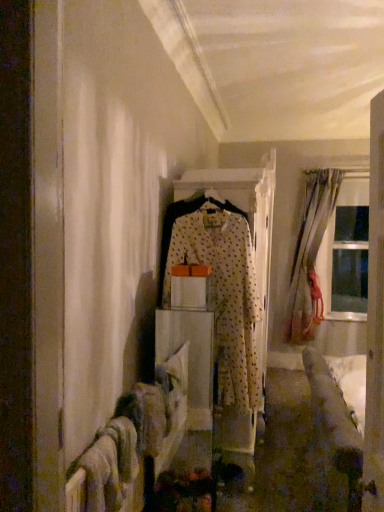
Question: Should I look upward or downward to see transparent glass window at right?

Choices:
 (A) down
 (B) up

Answer: (B)

Question: Is wooden door at right positioned before transparent glass window at right?

Choices:
 (A) no
 (B) yes

Answer: (B)

Question: Is wooden door at right not within transparent glass window at right?

Choices:
 (A) yes
 (B) no

Answer: (A)

Question: Is wooden door at right to the left of transparent glass window at right from the viewer's perspective?

Choices:
 (A) yes
 (B) no

Answer: (A)

Question: Can you confirm if wooden door at right is positioned to the right of transparent glass window at right?

Choices:
 (A) no
 (B) yes

Answer: (A)

Question: Is wooden door at right positioned behind transparent glass window at right?

Choices:
 (A) no
 (B) yes

Answer: (A)

Question: Can you confirm if wooden door at right is smaller than transparent glass window at right?

Choices:
 (A) no
 (B) yes

Answer: (B)

Question: From the image's perspective, is white dotted fabric at center on transparent glass window at right?

Choices:
 (A) yes
 (B) no

Answer: (B)

Question: From a real-world perspective, is white dotted fabric at center located higher than transparent glass window at right?

Choices:
 (A) no
 (B) yes

Answer: (A)

Question: Could you tell me if white dotted fabric at center is turned towards transparent glass window at right?

Choices:
 (A) no
 (B) yes

Answer: (A)

Question: Can you confirm if white dotted fabric at center is shorter than transparent glass window at right?

Choices:
 (A) yes
 (B) no

Answer: (A)

Question: Is the surface of white dotted fabric at center in direct contact with transparent glass window at right?

Choices:
 (A) yes
 (B) no

Answer: (B)

Question: Is white dotted fabric at center taller than transparent glass window at right?

Choices:
 (A) no
 (B) yes

Answer: (A)

Question: Can you see white dotted fabric at center touching wooden door at right?

Choices:
 (A) no
 (B) yes

Answer: (A)